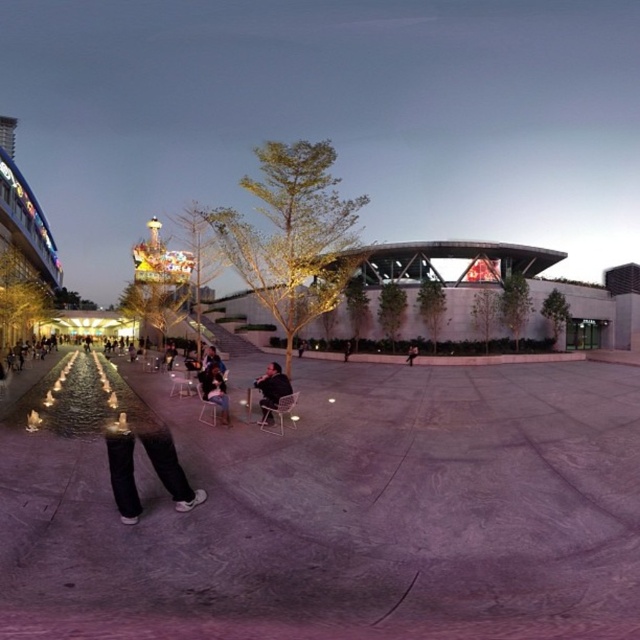
Question: Where is dark gray fabric jacket at center located in relation to dark blue jeans at center in the image?

Choices:
 (A) below
 (B) above

Answer: (B)

Question: Which point is closer to the camera?

Choices:
 (A) (216, 381)
 (B) (269, 387)
 (C) (442, 500)
 (D) (417, 353)

Answer: (C)

Question: Can you confirm if dark gray fabric jacket at center is bigger than dark gray pants at center?

Choices:
 (A) yes
 (B) no

Answer: (B)

Question: Based on their relative distances, which object is farther from the concrete skate park at center?

Choices:
 (A) dark gray fabric jacket at center
 (B) dark gray pants at center

Answer: (B)

Question: Which object is positioned farthest from the concrete skate park at center?

Choices:
 (A) dark gray fabric jacket at center
 (B) dark blue jeans at center

Answer: (A)

Question: Can you confirm if dark blue jeans at center is positioned above dark gray pants at center?

Choices:
 (A) no
 (B) yes

Answer: (B)